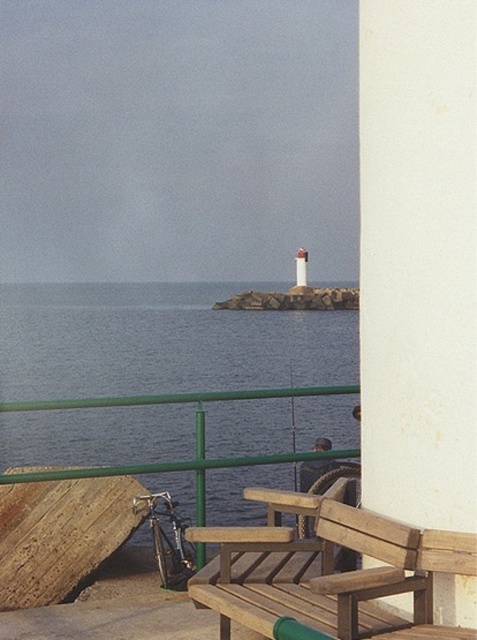
Does white smooth pillar at right come behind wooden bench at center?

Yes, it is behind wooden bench at center.

Between white smooth pillar at right and wooden bench at center, which one has less height?

With less height is wooden bench at center.

Locate an element on the screen. This screenshot has height=640, width=477. white smooth pillar at right is located at coordinates (418, 259).

Does blue water at center have a lesser width compared to wooden bench at center?

No, blue water at center is not thinner than wooden bench at center.

Between blue water at center and wooden bench at center, which one is positioned lower?

Positioned lower is wooden bench at center.

Is point (190, 346) less distant than point (299, 589)?

That is False.

I want to click on blue water at center, so click(162, 340).

Where is `wooden bench at center`? The image size is (477, 640). wooden bench at center is located at coordinates (329, 572).

Who is more distant from viewer, (237, 582) or (299, 276)?

Positioned behind is point (299, 276).

Where is `wooden bench at center`? Image resolution: width=477 pixels, height=640 pixels. wooden bench at center is located at coordinates (329, 572).